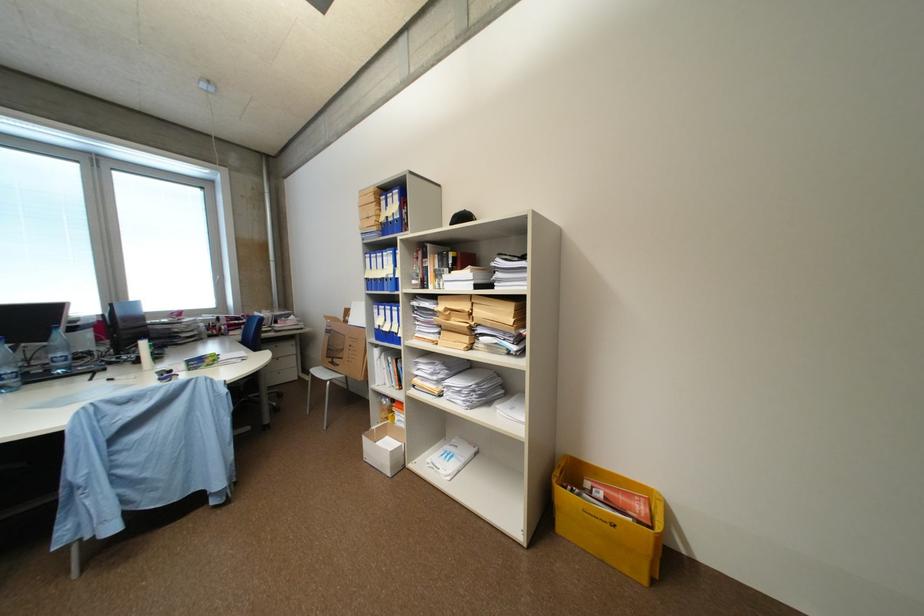
Where would you pull the drawer handle? Please return your answer as a coordinate pair (x, y).

(284, 355)